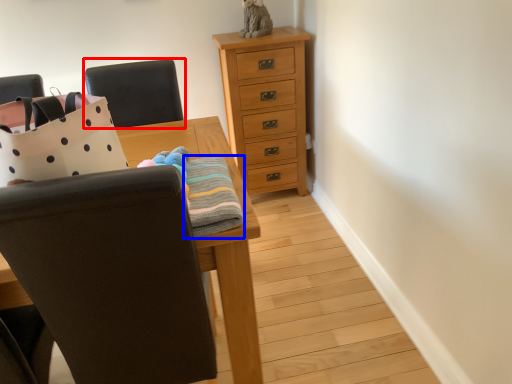
Question: Among these objects, which one is nearest to the camera, chair (highlighted by a red box) or blanket (highlighted by a blue box)?

Choices:
 (A) chair
 (B) blanket

Answer: (B)